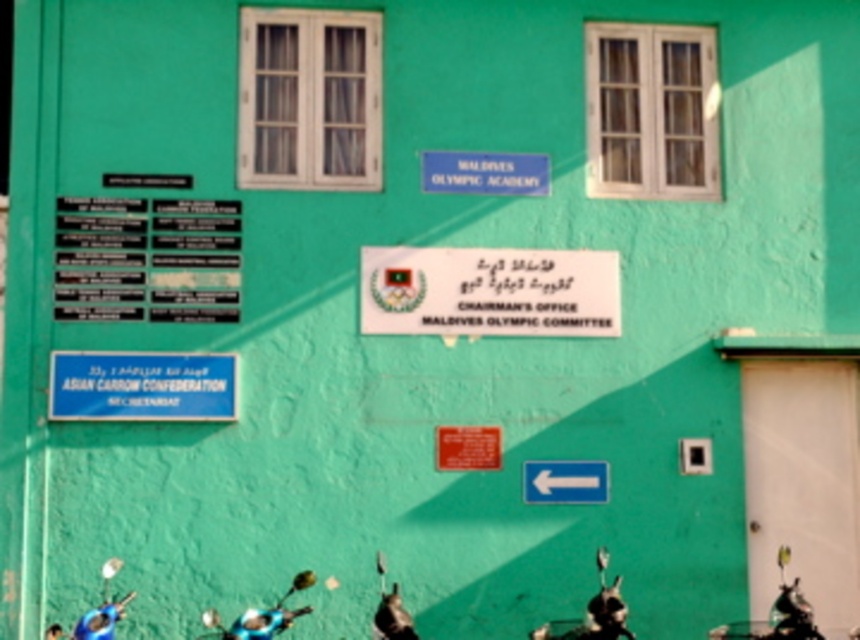
Does shiny chrome motorcycle at lower center have a lesser width compared to blue matte motorcycle at lower center?

Yes.

Is point (607, 632) behind point (255, 620)?

Yes, it is.

Does point (617, 630) lie in front of point (207, 627)?

Yes, it is.

Where is `shiny chrome motorcycle at lower center`? The width and height of the screenshot is (860, 640). shiny chrome motorcycle at lower center is located at coordinates (593, 612).